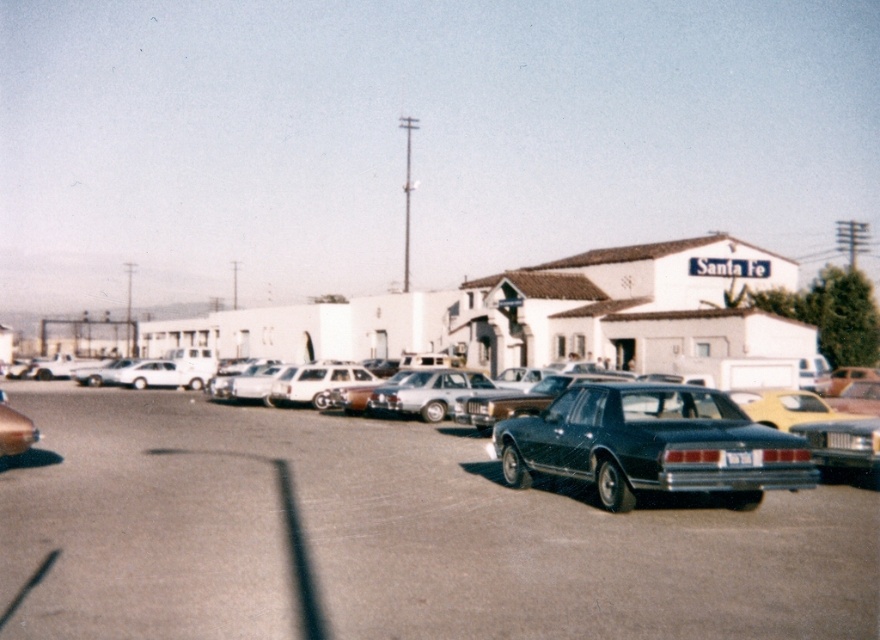
Question: Can you confirm if shiny dark blue sedan at center is bigger than black plastic license plate at center?

Choices:
 (A) no
 (B) yes

Answer: (B)

Question: Is shiny black car at center bigger than black plastic license plate at center?

Choices:
 (A) yes
 (B) no

Answer: (A)

Question: Which object is the closest to the black plastic license plate at center?

Choices:
 (A) shiny black car at center
 (B) shiny dark blue sedan at center

Answer: (B)

Question: Estimate the real-world distances between objects in this image. Which object is farther from the shiny black car at center?

Choices:
 (A) black plastic license plate at center
 (B) shiny dark blue sedan at center

Answer: (A)

Question: Does shiny dark blue sedan at center appear over black plastic license plate at center?

Choices:
 (A) no
 (B) yes

Answer: (B)

Question: Which object is the closest to the shiny dark blue sedan at center?

Choices:
 (A) shiny black car at center
 (B) black plastic license plate at center

Answer: (B)